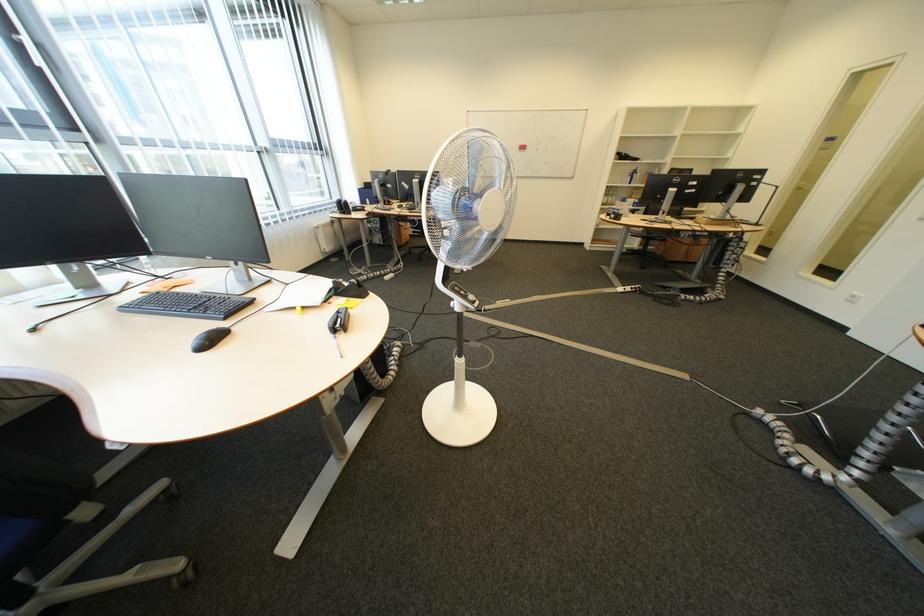
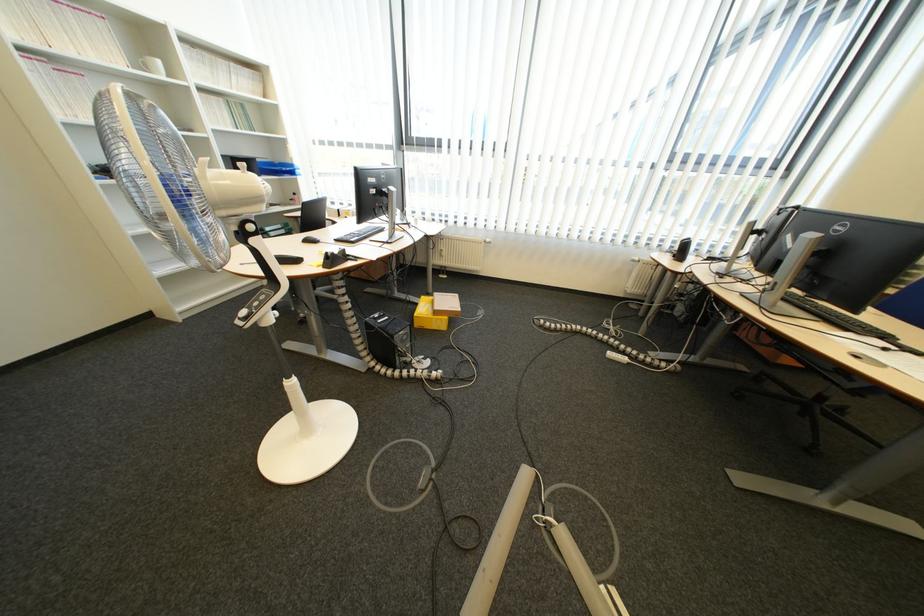
Locate, in the second image, the point that corresponds to (373,276) in the first image.

(619, 331)